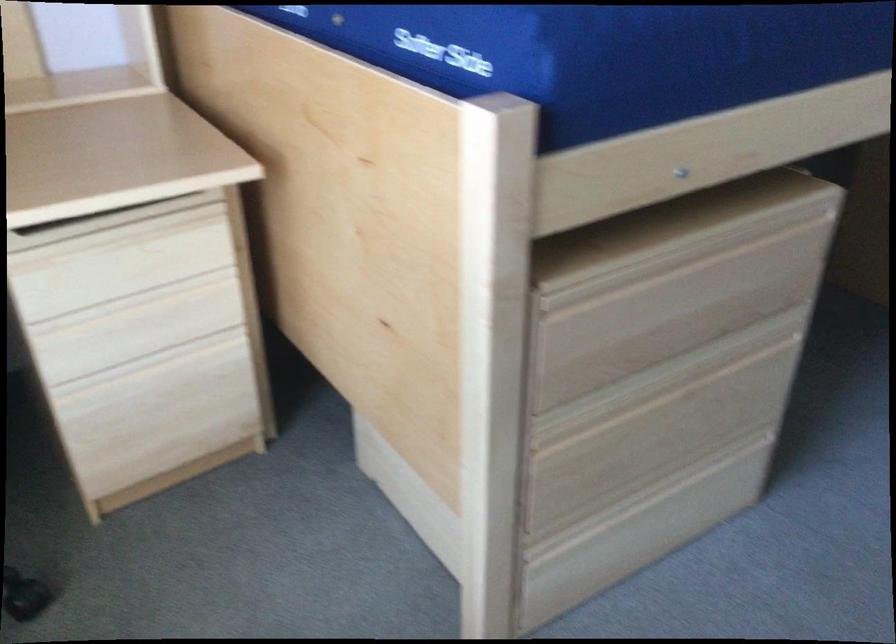
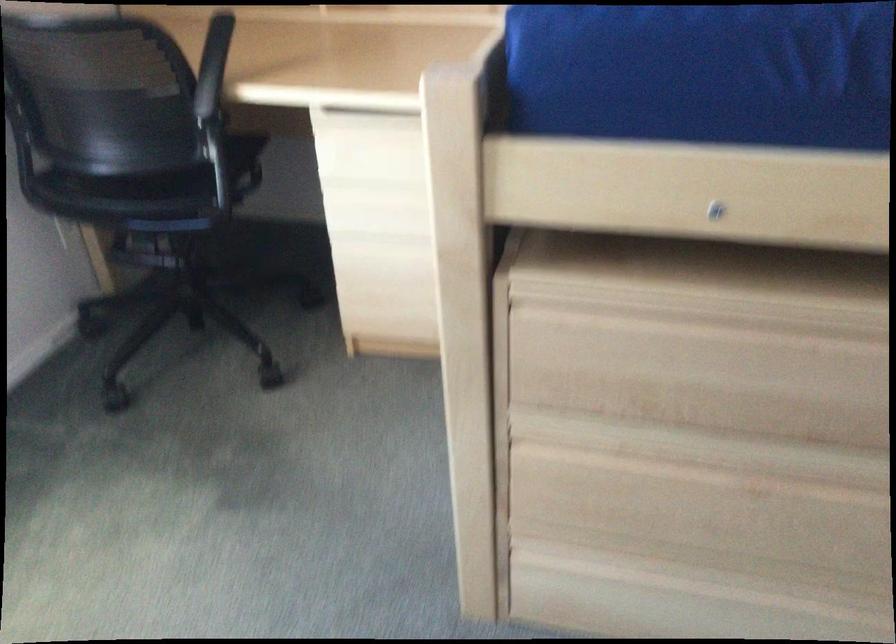
Question: I am providing you with two images of the same scene from different viewpoints. After the viewpoint changes to image2, which objects are now occluded?

Choices:
 (A) wooden drawer handle
 (B) chair sitting surface
 (C) black chair armrest
 (D) none of these

Answer: (D)